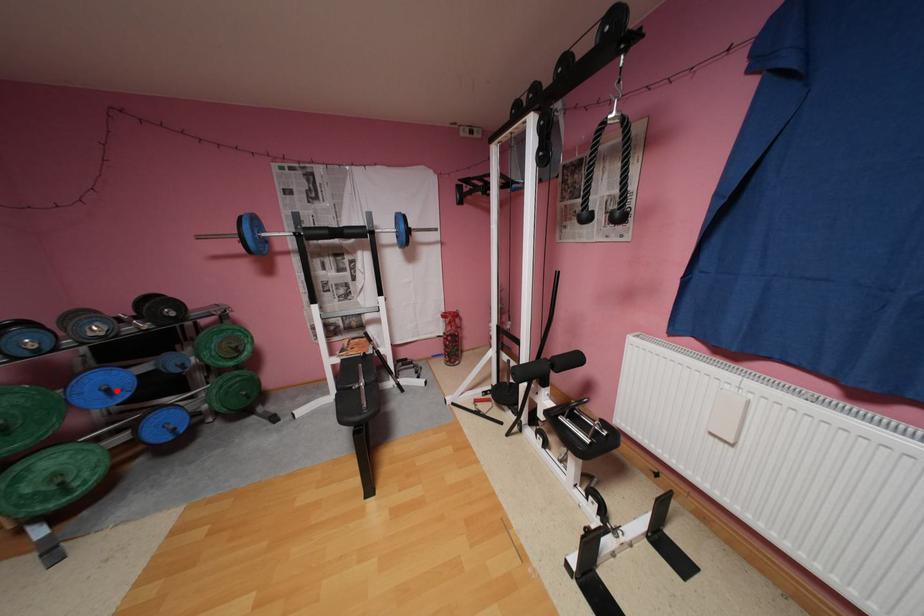
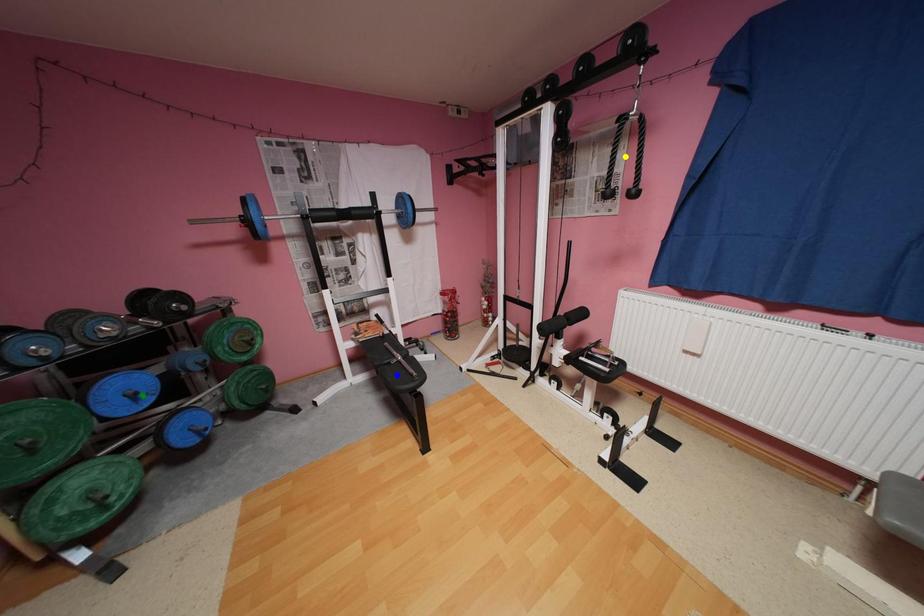
Question: I am providing you with two images of the same scene from different viewpoints. A red point is marked on the first image. You are given multiple points on the second image. In image 2, which mark is for the same physical point as the one in image 1?

Choices:
 (A) yellow point
 (B) green point
 (C) blue point

Answer: (B)